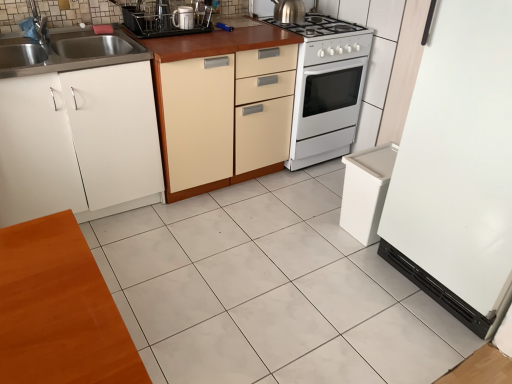
This screenshot has width=512, height=384. In order to click on vacant area that is in front of white glossy coffee maker at center, the 1th kitchen appliance ordered from the bottom in this screenshot , I will do click(x=181, y=36).